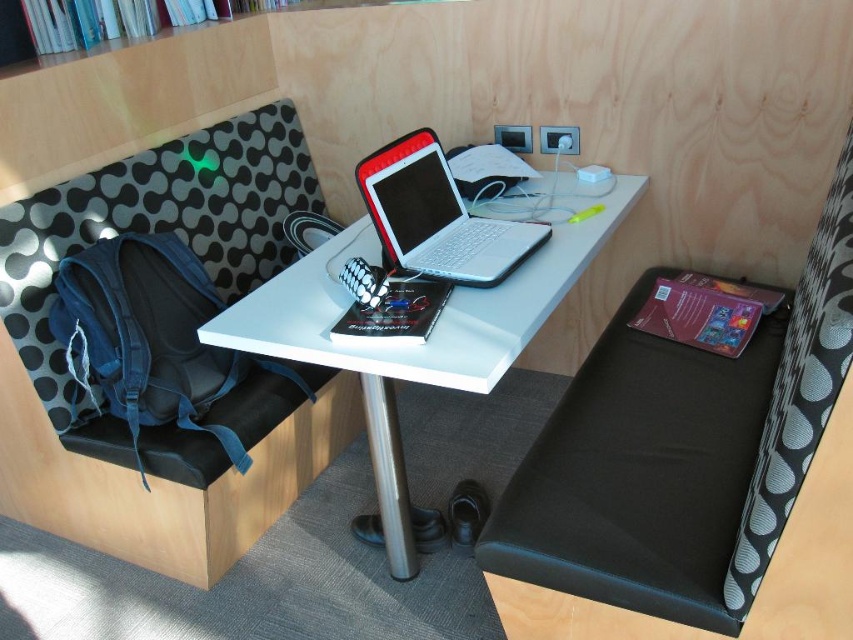
Who is more forward, [4,365] or [770,346]?

Positioned in front is point [770,346].

Is denim backpack at left smaller than black leather chair at lower right?

No.

Where is `denim backpack at left`? denim backpack at left is located at coordinates (213, 403).

Is black leather chair at lower right smaller than silver metallic laptop at center?

No, black leather chair at lower right is not smaller than silver metallic laptop at center.

Does point (616, 400) come farther from viewer compared to point (440, 216)?

No, (616, 400) is closer to viewer.

Is point (619, 369) behind point (383, 157)?

Yes, point (619, 369) is farther from viewer.

The image size is (853, 640). Find the location of `black leather chair at lower right`. black leather chair at lower right is located at coordinates (682, 451).

Does white glossy computer desk at center have a larger size compared to silver metallic laptop at center?

Yes, white glossy computer desk at center is bigger than silver metallic laptop at center.

Does white glossy computer desk at center lie behind silver metallic laptop at center?

No, white glossy computer desk at center is closer to the viewer.

Where is `white glossy computer desk at center`? white glossy computer desk at center is located at coordinates (434, 324).